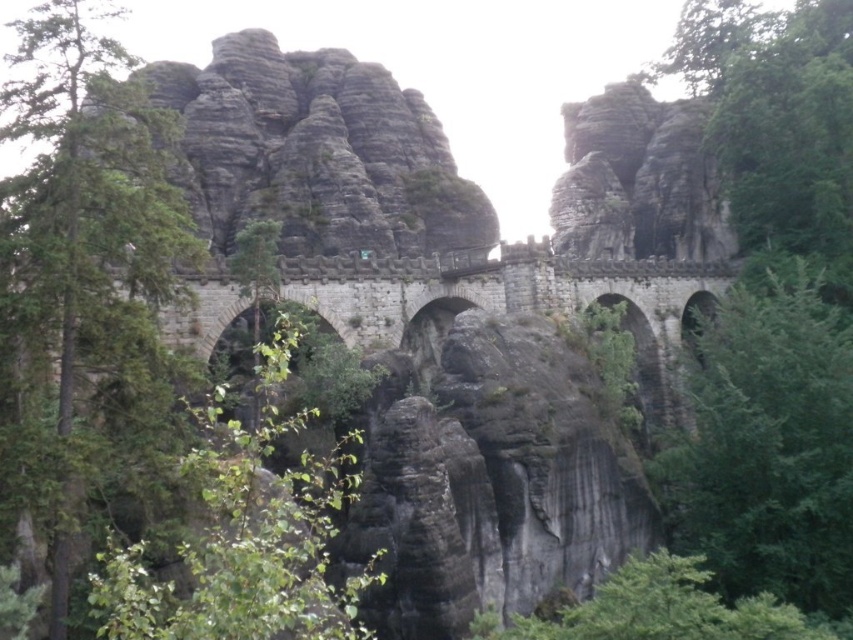
You are standing at the stone bridge and want to determine the relative positions of two points marked on the bridge. The first point is at coordinates point (x=811, y=372) and the second is at point (x=672, y=570). Which point is closer to you?

Point (x=811, y=372) is closer to the viewer than point (x=672, y=570) because it is further to the viewer according to their coordinates.

What is the exact coordinate of the green leafy tree at right in the image?

The green leafy tree at right is located at coordinate point (x=766, y=444).